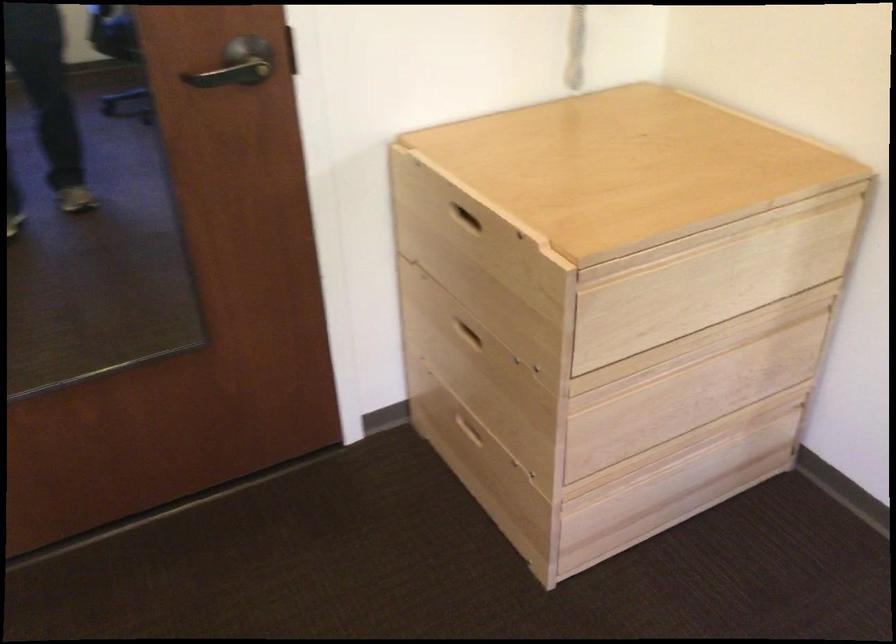
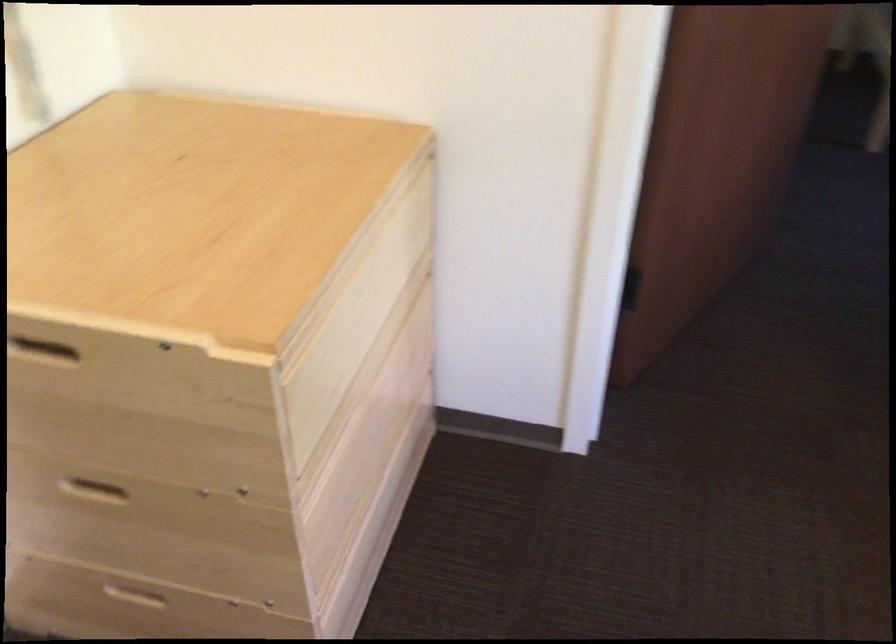
Find the pixel in the second image that matches pixel 466 436 in the first image.

(135, 600)